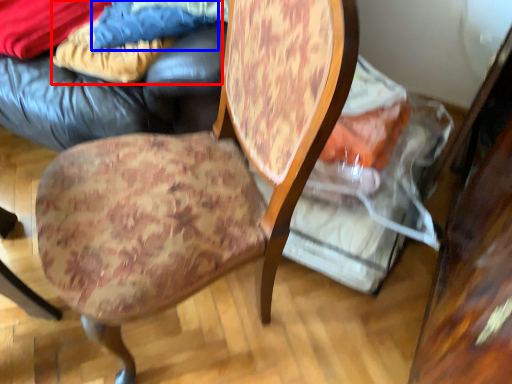
Question: Which of the following is the closest to the observer, fabric (highlighted by a red box) or fabric (highlighted by a blue box)?

Choices:
 (A) fabric
 (B) fabric

Answer: (B)